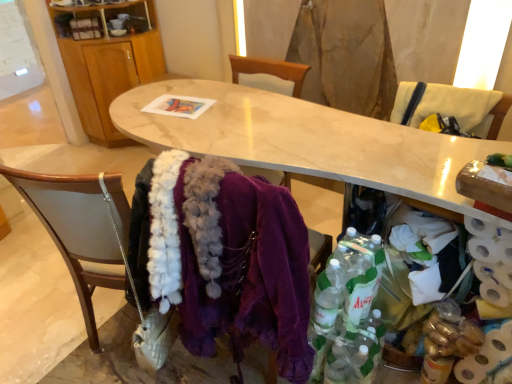
Question: Considering the positions of point (132, 44) and point (435, 89), is point (132, 44) closer or farther from the camera than point (435, 89)?

Choices:
 (A) farther
 (B) closer

Answer: (A)

Question: Relative to wooden armchair at right, is wooden cabinet at upper left in front or behind?

Choices:
 (A) front
 (B) behind

Answer: (B)

Question: Estimate the real-world distances between objects in this image. Which object is closer to the wooden chair at lower left, which ranks as the first chair in left-to-right order?

Choices:
 (A) white fabric chair at upper right, placed as the first chair when sorted from right to left
 (B) wooden cabinet at upper left
 (C) translucent plastic bottles at lower right
 (D) marble table at center
 (E) wooden armchair at right

Answer: (D)

Question: Considering the real-world distances, which object is closest to the white textured toilet paper at lower right?

Choices:
 (A) translucent plastic bottles at lower right
 (B) white fabric chair at upper right, placed as the second chair when sorted from left to right
 (C) marble table at center
 (D) wooden cabinet at upper left
 (E) wooden chair at lower left, marked as the 1th chair in a bottom-to-top arrangement

Answer: (A)